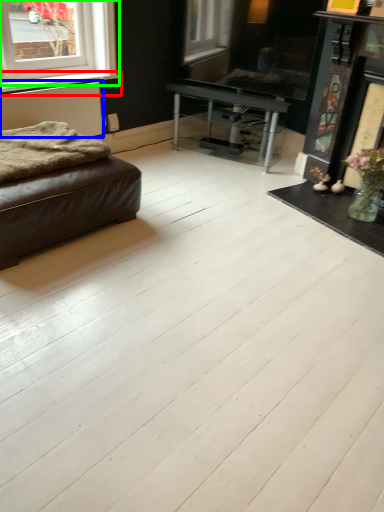
Question: Which object is the closest to the window sill (highlighted by a red box)? Choose among these: radiator (highlighted by a blue box) or window (highlighted by a green box).

Choices:
 (A) radiator
 (B) window

Answer: (A)